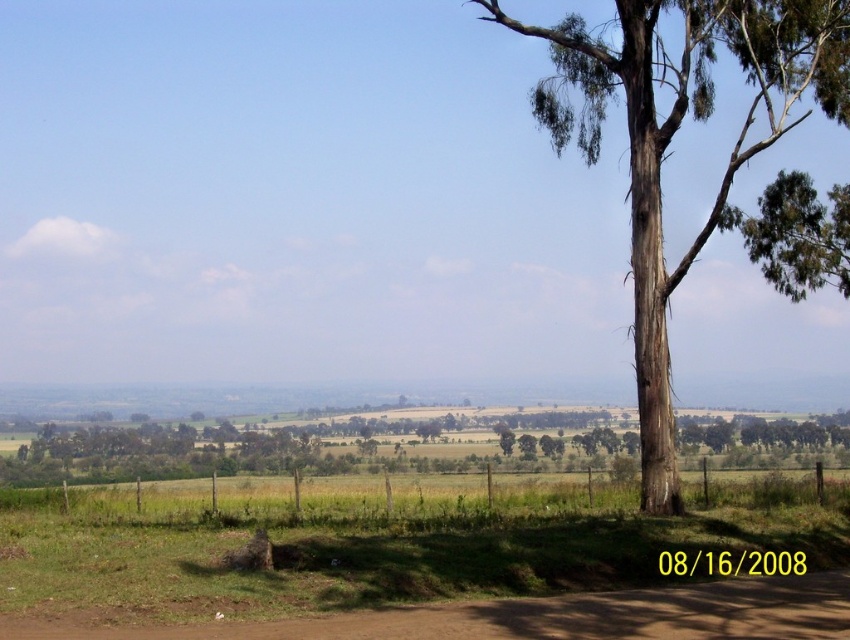
Looking at this image, you are driving a car on the brown dirt track at lower center and want to park near the green bark tree at right. Which direction should you turn to reach the tree?

You should turn to the right because the green bark tree at right is located to the right of the brown dirt track at lower center.

You are standing at the edge of the brown dirt track at lower center and want to walk towards the green bark tree at right. Which direction should you face to ensure the tree is visible in your path?

To walk towards the green bark tree at right from the brown dirt track at lower center, you should face towards the right side since the tree is positioned to the right of the track.